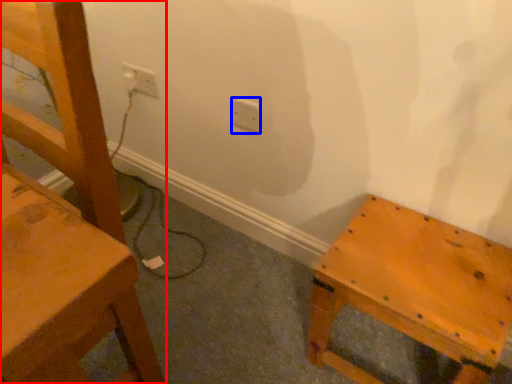
Question: Which object appears farthest to the camera in this image, chair (highlighted by a red box) or electric outlet (highlighted by a blue box)?

Choices:
 (A) chair
 (B) electric outlet

Answer: (B)